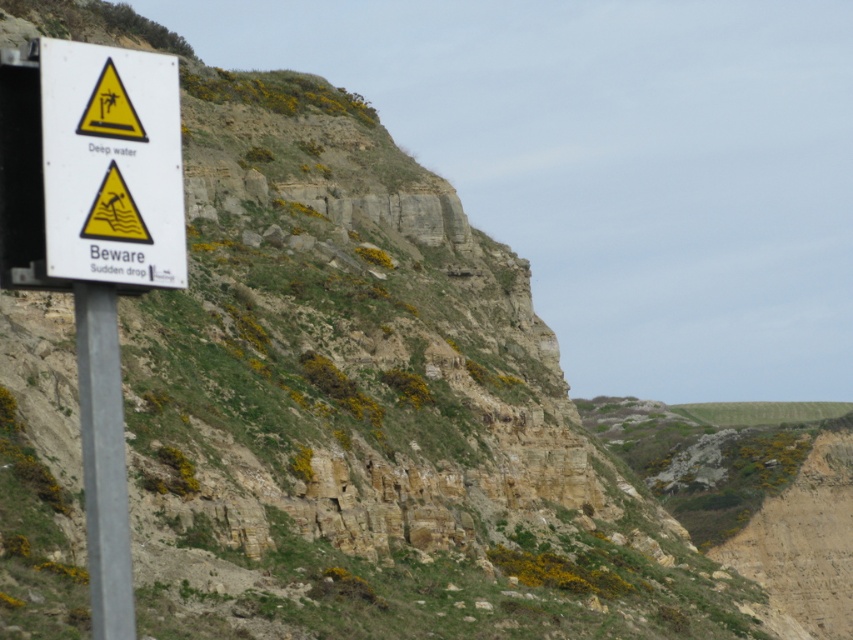
Question: Which object is positioned farthest from the metallic pole at left?

Choices:
 (A) white paper sign at left
 (B) white plastic sign at left

Answer: (B)

Question: Can you confirm if white paper sign at left is positioned above white plastic sign at left?

Choices:
 (A) yes
 (B) no

Answer: (B)

Question: Which point appears farthest from the camera in this image?

Choices:
 (A) (84, 476)
 (B) (177, 106)
 (C) (93, 356)

Answer: (A)

Question: Does white paper sign at left appear over metallic pole at left?

Choices:
 (A) no
 (B) yes

Answer: (B)

Question: Estimate the real-world distances between objects in this image. Which object is farther from the white plastic sign at left?

Choices:
 (A) white paper sign at left
 (B) metallic pole at left

Answer: (B)

Question: Considering the relative positions of white paper sign at left and metallic pole at left in the image provided, where is white paper sign at left located with respect to metallic pole at left?

Choices:
 (A) left
 (B) right

Answer: (B)